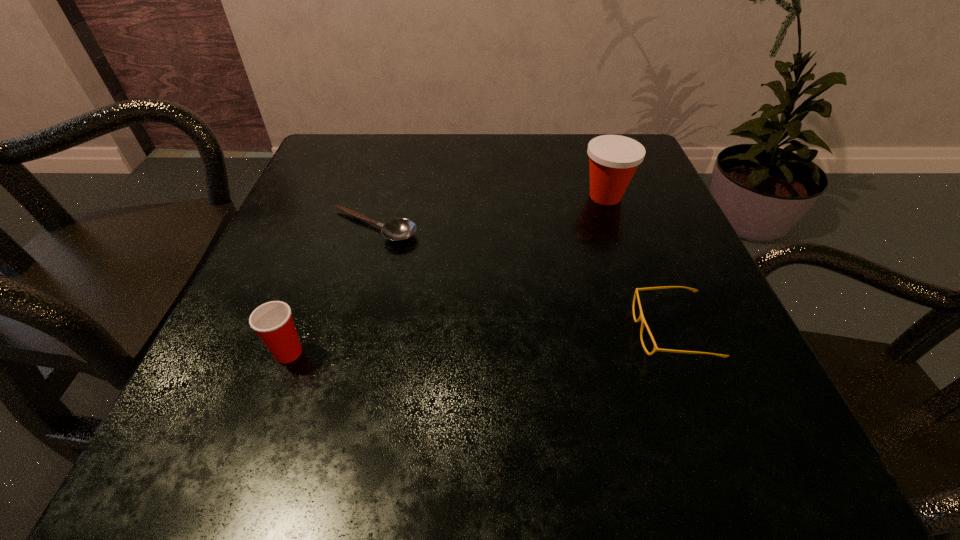
Find the location of a particular element. This screenshot has width=960, height=540. the tallest object is located at coordinates (613, 159).

The image size is (960, 540). What are the coordinates of `the farther Dixie cup` in the screenshot? It's located at (613, 159).

You are a GUI agent. You are given a task and a screenshot of the screen. Output one action in this format:
    pyautogui.click(x=<x>, y=<y>)
    Task: Click on the left Dixie cup
    
    Given the screenshot: What is the action you would take?
    pyautogui.click(x=272, y=321)

The image size is (960, 540). I want to click on the second tallest object, so click(x=272, y=321).

The height and width of the screenshot is (540, 960). Find the location of `the second shortest object`. the second shortest object is located at coordinates (641, 318).

The image size is (960, 540). In order to click on the shortest object in this screenshot , I will do `click(400, 229)`.

What are the coordinates of `vacant area situated 0.190m on the front of the taller Dixie cup` in the screenshot? It's located at (636, 282).

The height and width of the screenshot is (540, 960). I want to click on vacant area located 0.360m on the right of the left Dixie cup, so click(564, 353).

Where is `blank space located 0.150m in front of the lenses of the spectacles`? This screenshot has height=540, width=960. blank space located 0.150m in front of the lenses of the spectacles is located at coordinates (534, 332).

You are a GUI agent. You are given a task and a screenshot of the screen. Output one action in this format:
    pyautogui.click(x=<x>, y=<y>)
    Task: Click on the free point located in front of the lenses of the spectacles
    Image resolution: width=960 pixels, height=540 pixels.
    Given the screenshot: What is the action you would take?
    pyautogui.click(x=370, y=332)